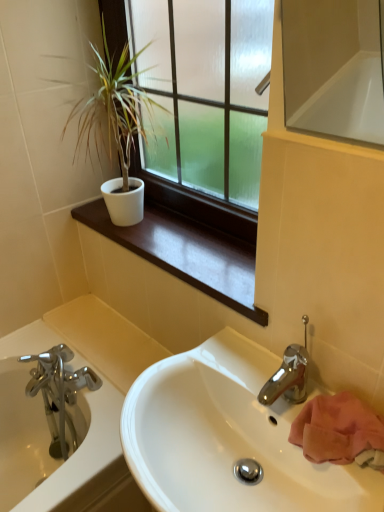
Where is `white matte window sill at upper center`? white matte window sill at upper center is located at coordinates (189, 243).

Locate an element on the screen. This screenshot has width=384, height=512. white matte pot at upper left is located at coordinates (116, 127).

What do you see at coordinates (116, 127) in the screenshot?
I see `white matte pot at upper left` at bounding box center [116, 127].

Locate an element on the screen. brushed metal bathtub at lower left is located at coordinates (50, 437).

Based on their positions, is white matte pot at upper left located to the left or right of white matte window sill at upper center?

white matte pot at upper left is positioned on white matte window sill at upper center's left side.

Can we say white matte pot at upper left lies outside white matte window sill at upper center?

white matte pot at upper left is positioned outside white matte window sill at upper center.

Is white matte pot at upper left positioned with its back to white matte window sill at upper center?

No, white matte pot at upper left is not facing away from white matte window sill at upper center.

Is white matte pot at upper left far from brushed metal bathtub at lower left?

No, there isn't a large distance between white matte pot at upper left and brushed metal bathtub at lower left.

From the image's perspective, is white matte pot at upper left on brushed metal bathtub at lower left?

Yes, from the image's perspective, white matte pot at upper left is over brushed metal bathtub at lower left.

Is white matte pot at upper left behind brushed metal bathtub at lower left?

No, it is not.

Is white matte pot at upper left wider than brushed metal bathtub at lower left?

Indeed, white matte pot at upper left has a greater width compared to brushed metal bathtub at lower left.

Is white glossy sink at center in contact with white matte window sill at upper center?

white glossy sink at center and white matte window sill at upper center are not in contact.

How different are the orientations of white glossy sink at center and white matte window sill at upper center in degrees?

0.726 degrees.

Based on the photo, in terms of size, does white glossy sink at center appear bigger or smaller than white matte window sill at upper center?

Clearly, white glossy sink at center is larger in size than white matte window sill at upper center.

In the scene shown: Is brushed metal bathtub at lower left bigger than white matte pot at upper left?

Actually, brushed metal bathtub at lower left might be smaller than white matte pot at upper left.

Visually, is brushed metal bathtub at lower left positioned to the left or to the right of white matte pot at upper left?

Based on their positions, brushed metal bathtub at lower left is located to the left of white matte pot at upper left.

Find the location of `houseplant above the brushed metal bathtub at lower left (from a real-world perspective)`. houseplant above the brushed metal bathtub at lower left (from a real-world perspective) is located at coordinates (116, 127).

Would you say white matte pot at upper left is part of brushed metal bathtub at lower left's contents?

No.

Are white glossy sink at center and white matte pot at upper left located far from each other?

That's not correct — white glossy sink at center is a little close to white matte pot at upper left.

Which of these two, white glossy sink at center or white matte pot at upper left, is wider?

Wider between the two is white glossy sink at center.

Is white glossy sink at center at the right side of white matte pot at upper left?

A: Correct, you'll find white glossy sink at center to the right of white matte pot at upper left.

Is white glossy sink at center facing away from white matte pot at upper left?

No, white glossy sink at center is not facing away from white matte pot at upper left.

Is white matte window sill at upper center next to white glossy sink at center and touching it?

white matte window sill at upper center is not next to white glossy sink at center, and they're not touching.

From the picture: Is the position of white matte window sill at upper center more distant than that of white glossy sink at center?

Yes, white matte window sill at upper center is behind white glossy sink at center.

Which of these two, white matte window sill at upper center or white glossy sink at center, stands taller?

With more height is white glossy sink at center.

Is white matte pot at upper left wider or thinner than matte glass window at upper center?

Considering their sizes, white matte pot at upper left looks broader than matte glass window at upper center.

Identify the location of houseplant behind the matte glass window at upper center. This screenshot has height=512, width=384. pyautogui.click(x=116, y=127).

Is white matte pot at upper left aimed at matte glass window at upper center?

No, white matte pot at upper left is not turned towards matte glass window at upper center.

Where is `houseplant on the left of the white matte window sill at upper center`? houseplant on the left of the white matte window sill at upper center is located at coordinates (116, 127).

Locate an element on the screen. bathtub that is below the white matte pot at upper left (from the image's perspective) is located at coordinates (50, 437).

Which object lies nearer to the anchor point white glossy sink at center, matte glass window at upper center or brushed metal bathtub at lower left?

Based on the image, brushed metal bathtub at lower left appears to be nearer to white glossy sink at center.

Which object lies further to the anchor point white matte pot at upper left, brushed metal bathtub at lower left or white glossy sink at center?

The object further to white matte pot at upper left is brushed metal bathtub at lower left.

Estimate the real-world distances between objects in this image. Which object is further from brushed metal bathtub at lower left, white matte pot at upper left or white glossy sink at center?

Based on the image, white matte pot at upper left appears to be further to brushed metal bathtub at lower left.

Considering their positions, is brushed metal bathtub at lower left positioned closer to white matte window sill at upper center than matte glass window at upper center?

matte glass window at upper center is positioned closer to the anchor white matte window sill at upper center.

Based on their spatial positions, is brushed metal bathtub at lower left or white matte window sill at upper center further from matte glass window at upper center?

The object further to matte glass window at upper center is brushed metal bathtub at lower left.

From the image, which object appears to be nearer to white matte window sill at upper center, brushed metal bathtub at lower left or white glossy sink at center?

white glossy sink at center is positioned closer to the anchor white matte window sill at upper center.

Based on their spatial positions, is brushed metal bathtub at lower left or white matte window sill at upper center closer to white matte pot at upper left?

white matte window sill at upper center lies closer to white matte pot at upper left than the other object.

Estimate the real-world distances between objects in this image. Which object is further from matte glass window at upper center, white matte window sill at upper center or white matte pot at upper left?

Based on the image, white matte window sill at upper center appears to be further to matte glass window at upper center.

You are a GUI agent. You are given a task and a screenshot of the screen. Output one action in this format:
    pyautogui.click(x=<x>, y=<y>)
    Task: Click on the window between white matte pot at upper left and white glossy sink at center in the vertical direction
    The height and width of the screenshot is (512, 384).
    Given the screenshot: What is the action you would take?
    pyautogui.click(x=202, y=101)

Identify the location of bathtub between white matte pot at upper left and white glossy sink at center vertically. (50, 437).

I want to click on window between white matte pot at upper left and brushed metal bathtub at lower left in the up-down direction, so click(x=202, y=101).

This screenshot has height=512, width=384. I want to click on window sill that lies between white matte pot at upper left and white glossy sink at center from top to bottom, so click(x=189, y=243).